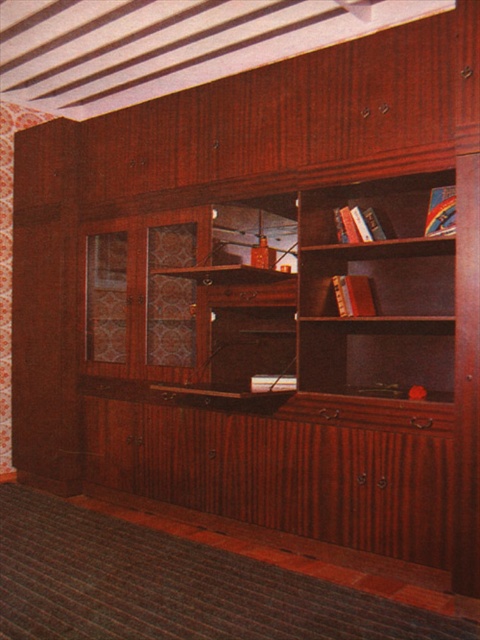
Question: Can you confirm if wooden bookshelf at center is positioned above wooden bookshelf at upper right?

Choices:
 (A) yes
 (B) no

Answer: (B)

Question: Is wooden bookshelf at center positioned before wooden bookshelf at upper right?

Choices:
 (A) no
 (B) yes

Answer: (B)

Question: Does wooden bookshelf at center appear on the right side of wooden bookshelf at upper right?

Choices:
 (A) no
 (B) yes

Answer: (A)

Question: Which point appears farthest from the camera in this image?

Choices:
 (A) (314, 244)
 (B) (411, 195)

Answer: (B)